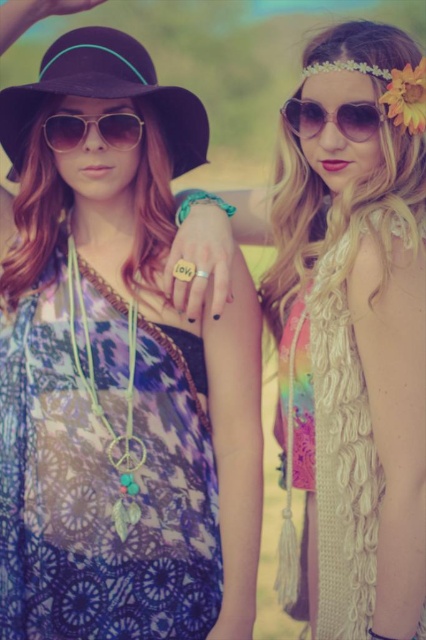
Question: Which point is farther to the camera?

Choices:
 (A) white knitted scarf at upper right
 (B) matte black sunglasses at center
 (C) sunglasses at upper right

Answer: (B)

Question: Does white knitted scarf at upper right have a greater width compared to black felt hat at upper left?

Choices:
 (A) yes
 (B) no

Answer: (B)

Question: Is crochet lace dress at center below matte black sunglasses at center?

Choices:
 (A) no
 (B) yes

Answer: (B)

Question: Which object is positioned closest to the sunglasses at upper right?

Choices:
 (A) white knitted scarf at upper right
 (B) matte black sunglasses at center
 (C) white knitted vest at right

Answer: (A)

Question: Does white knitted scarf at upper right have a greater width compared to matte black sunglasses at center?

Choices:
 (A) yes
 (B) no

Answer: (A)

Question: Which object is the farthest from the sunglasses at upper right?

Choices:
 (A) black felt hat at upper left
 (B) white knitted scarf at upper right
 (C) matte black sunglasses at center

Answer: (C)